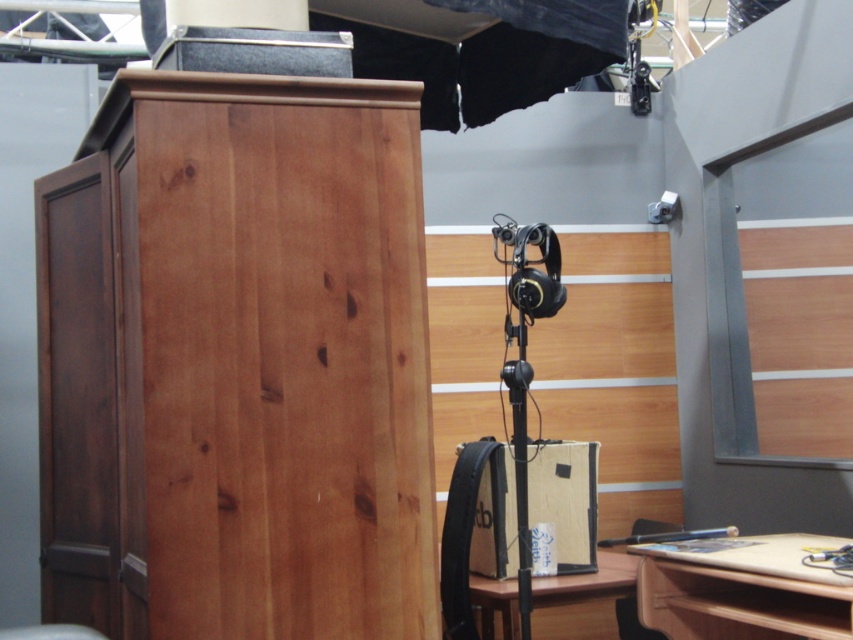
Is wooden desk at lower right positioned in front of wooden desk at lower center?

Yes, it is.

Is point (688, 563) farther from viewer compared to point (549, 582)?

No, it is in front of (549, 582).

Is point (753, 625) farther from camera compared to point (627, 582)?

That is True.

Image resolution: width=853 pixels, height=640 pixels. What are the coordinates of `wooden desk at lower right` in the screenshot? It's located at (740, 589).